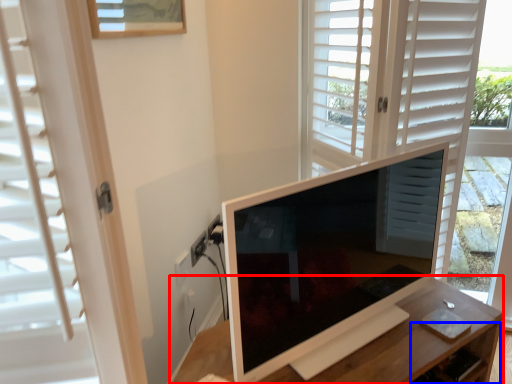
Question: Which object appears farthest to the camera in this image, table (highlighted by a red box) or drawer (highlighted by a blue box)?

Choices:
 (A) table
 (B) drawer

Answer: (B)